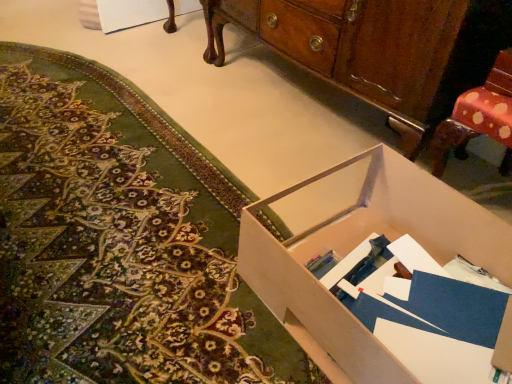
The height and width of the screenshot is (384, 512). Find the location of `free space to the left of wooden cabinet at center`. free space to the left of wooden cabinet at center is located at coordinates [194, 90].